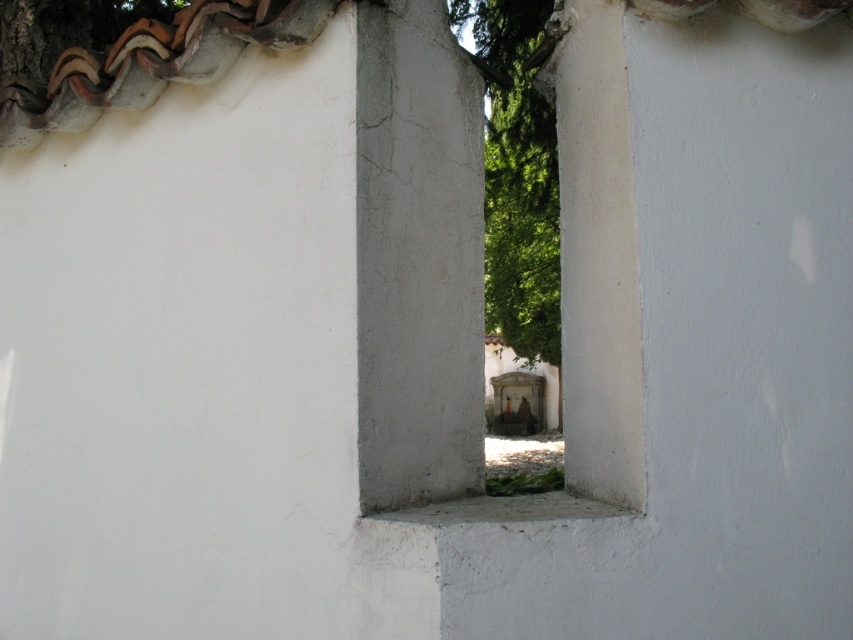
From the picture: You are standing in front of the opening framed by two weathered white walls. You notice two points marked in the scene. From your perspective, which point is closer to you, point (463, 276) or point (543, 28)?

Point (463, 276) is closer to the camera than point (543, 28).

You are standing in a room and want to reach the white rough concrete window at center to open it. If your arm can extend 1.8 meters, can you reach it without moving closer?

The white rough concrete window at center is 2.20 meters away from the camera. Since your arm can only extend 1.8 meters, you cannot reach it without moving closer.

You are a painter standing 2 meters away from the white rough concrete window at center. You want to paint the green leafy tree at center through the window. Can you reach the tree with your paintbrush if you can extend your arm 1.5 meters?

The distance between the white rough concrete window at center and the green leafy tree at center is 4.63 meters. Since you are 2 meters away from the window and can only extend your arm 1.5 meters, the total distance you can reach is 3.5 meters, which is less than 4.63 meters. Therefore, you cannot reach the tree with your paintbrush.